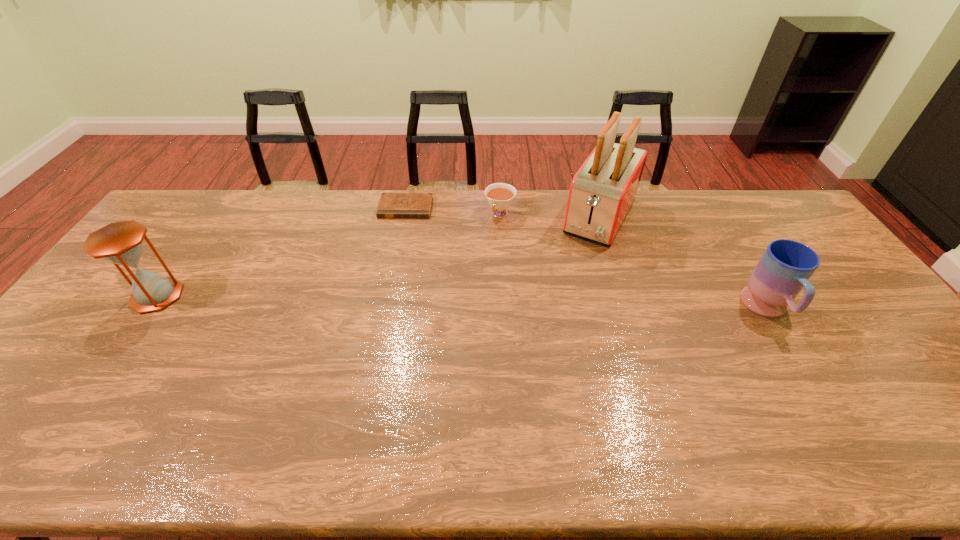
Where is `blank area located on the front of the second tallest object`? blank area located on the front of the second tallest object is located at coordinates (77, 410).

Find the location of `vacant region located 0.140m on the side of the third shortest object with the handle`. vacant region located 0.140m on the side of the third shortest object with the handle is located at coordinates (811, 381).

You are a GUI agent. You are given a task and a screenshot of the screen. Output one action in this format:
    pyautogui.click(x=<x>, y=<y>)
    Task: Click on the vacant space situated on the side of the second shortest object with the handle
    
    Given the screenshot: What is the action you would take?
    pyautogui.click(x=446, y=300)

Where is `vacant area situated on the side of the second shortest object with the handle`? The height and width of the screenshot is (540, 960). vacant area situated on the side of the second shortest object with the handle is located at coordinates pos(488,234).

The image size is (960, 540). What are the coordinates of `vacant space located on the side of the second shortest object with the handle` in the screenshot? It's located at 475,255.

At what (x,y) coordinates should I click in order to perform the action: click on free space located 0.330m on the front-facing side of the second object from right to left. Please return your answer as a coordinate pair (x, y). Looking at the image, I should click on (549, 314).

Identify the location of vacant space situated 0.120m on the front-facing side of the second object from right to left. The width and height of the screenshot is (960, 540). (575, 268).

Locate an element on the screen. The width and height of the screenshot is (960, 540). blank area located 0.190m on the front-facing side of the second object from right to left is located at coordinates (567, 282).

In order to click on vacant space positioned 0.100m on the spine side of the fourth object from right to left in this screenshot , I will do `click(399, 238)`.

Identify the location of vacant space located on the spine side of the fourth object from right to left. (396, 254).